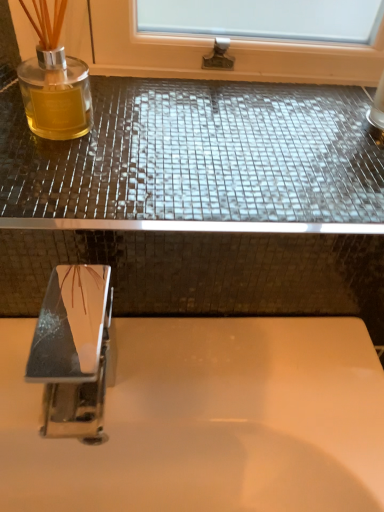
Locate an element on the screen. The image size is (384, 512). empty space that is ontop of white glossy sink at center (from a real-world perspective) is located at coordinates (205, 377).